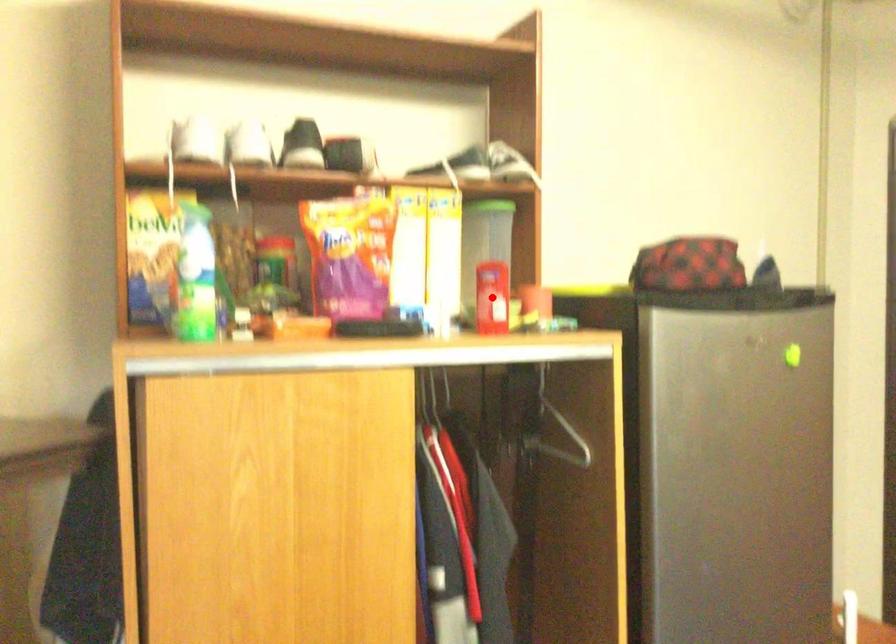
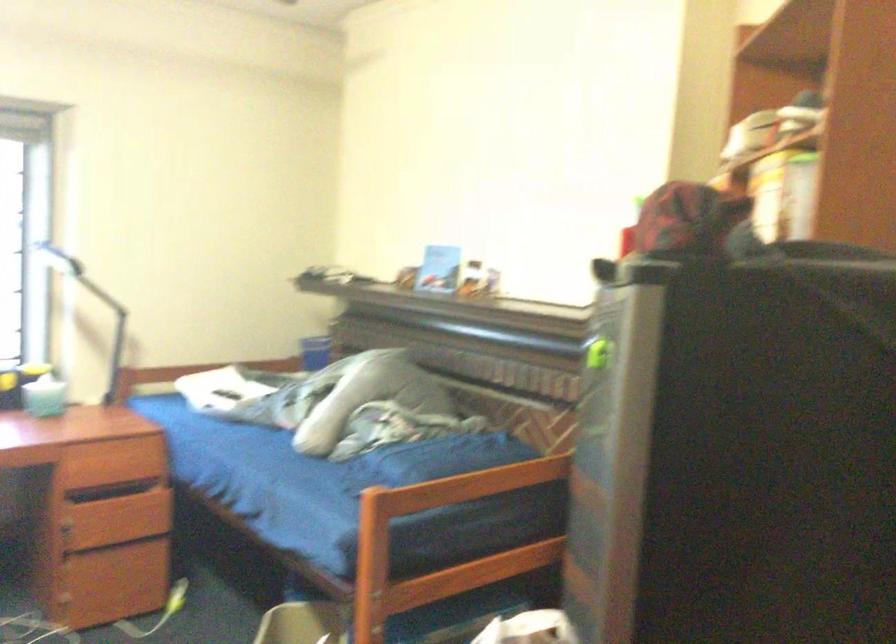
Question: I am providing you with two images of the same scene from different viewpoints. A red point is marked on the first image. Can you still see the location of the red point in image 2?

Choices:
 (A) Yes
 (B) No

Answer: (B)